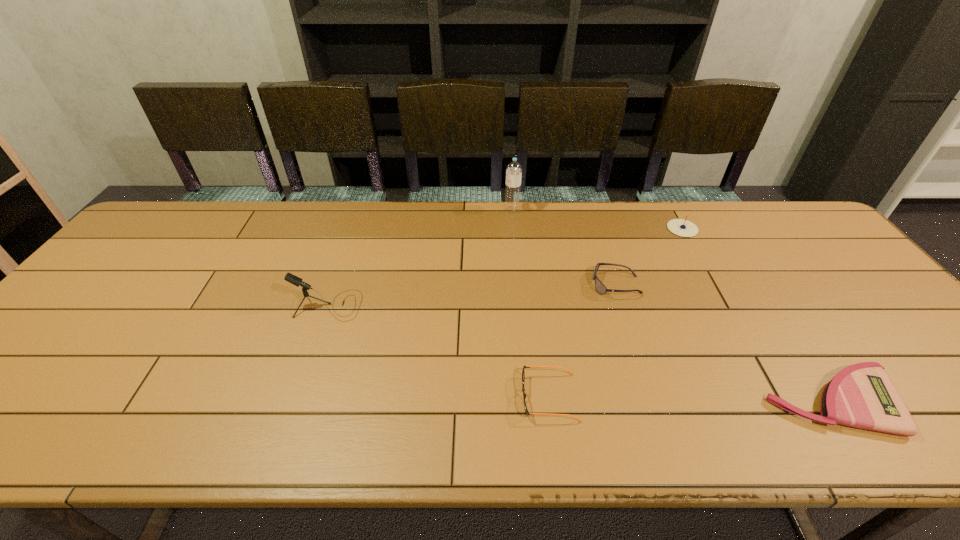
Locate an element on the screen. water bottle present at the far edge is located at coordinates (514, 169).

Find the location of `compass at the far edge`. compass at the far edge is located at coordinates (680, 227).

This screenshot has width=960, height=540. Identify the location of wristlet at the near edge. (862, 395).

The image size is (960, 540). Identify the location of spectacles positioned at the near edge. (523, 372).

Image resolution: width=960 pixels, height=540 pixels. I want to click on object at the right edge, so click(x=862, y=395).

Find the location of a particular element. This screenshot has width=960, height=540. object situated at the near right corner is located at coordinates (862, 395).

This screenshot has height=540, width=960. I want to click on free space at the far edge, so click(x=423, y=202).

This screenshot has height=540, width=960. In order to click on free region at the near edge of the desktop in this screenshot , I will do `click(741, 432)`.

You are a GUI agent. You are given a task and a screenshot of the screen. Output one action in this format:
    pyautogui.click(x=<x>, y=<y>)
    Task: Click on the free spot at the left edge of the desktop
    
    Given the screenshot: What is the action you would take?
    pyautogui.click(x=61, y=390)

This screenshot has width=960, height=540. In order to click on free space at the right edge of the desktop in this screenshot , I will do `click(929, 377)`.